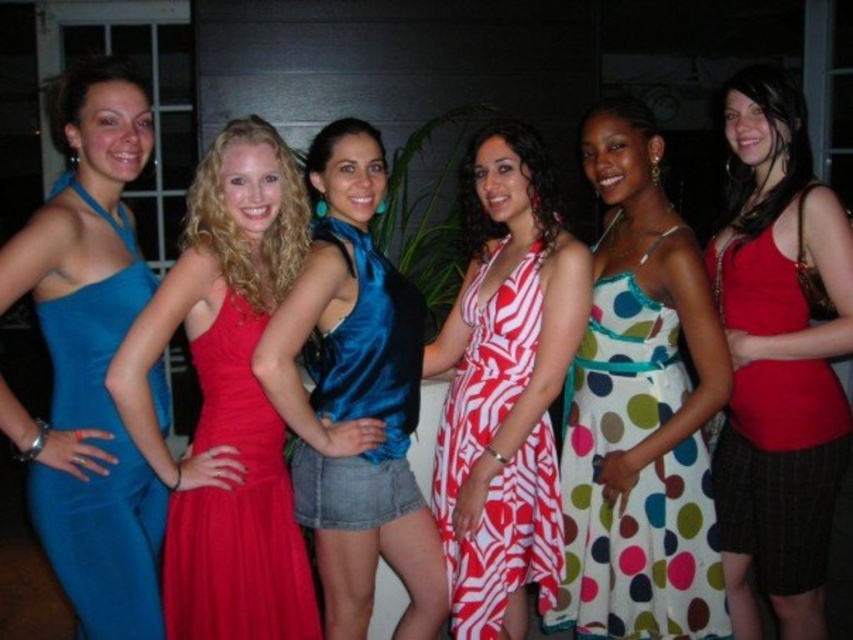
Question: Which point is farther from the camera taking this photo?

Choices:
 (A) (100, 138)
 (B) (175, 580)
 (C) (490, 387)

Answer: (C)

Question: Does satin blue top at center have a lesser width compared to multicolored polka dot dress at center?

Choices:
 (A) yes
 (B) no

Answer: (A)

Question: Which object is farther from the camera taking this photo?

Choices:
 (A) multicolored polka dot dress at center
 (B) shiny satin dress at center

Answer: (A)

Question: Does red satin tank top at center lie behind matte blue dress at left?

Choices:
 (A) yes
 (B) no

Answer: (A)

Question: Which is nearer to the multicolored polka dot dress at center?

Choices:
 (A) satin blue top at center
 (B) matte blue dress at left
 (C) red satin tank top at center

Answer: (C)

Question: Does satin blue top at center appear on the right side of white and red striped dress at center?

Choices:
 (A) no
 (B) yes

Answer: (A)